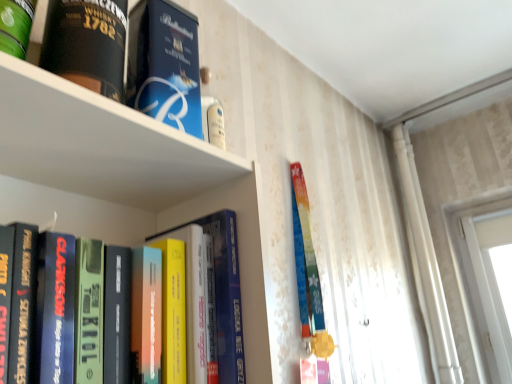
Question: Is blue cardboard box at upper center, positioned as the second book in bottom-to-top order, not inside hardcover book at left, arranged as the fourth book when viewed from the top?

Choices:
 (A) no
 (B) yes

Answer: (B)

Question: Is blue cardboard box at upper center, positioned as the second book in bottom-to-top order, positioned far away from hardcover book at left, arranged as the fourth book when viewed from the top?

Choices:
 (A) yes
 (B) no

Answer: (B)

Question: Considering the relative positions of blue cardboard box at upper center, positioned as the second book in bottom-to-top order, and hardcover book at left, arranged as the fourth book when viewed from the top, in the image provided, is blue cardboard box at upper center, positioned as the second book in bottom-to-top order, to the left of hardcover book at left, arranged as the fourth book when viewed from the top, from the viewer's perspective?

Choices:
 (A) no
 (B) yes

Answer: (A)

Question: Is blue cardboard box at upper center, positioned as the second book in bottom-to-top order, facing away from hardcover book at left, arranged as the fourth book when viewed from the top?

Choices:
 (A) yes
 (B) no

Answer: (B)

Question: Considering the relative sizes of blue cardboard box at upper center, positioned as the second book in bottom-to-top order, and hardcover book at left, marked as the first book in a bottom-to-top arrangement, in the image provided, is blue cardboard box at upper center, positioned as the second book in bottom-to-top order, taller than hardcover book at left, marked as the first book in a bottom-to-top arrangement,?

Choices:
 (A) yes
 (B) no

Answer: (A)

Question: In terms of height, does blue cardboard box at upper center, positioned as the second book in bottom-to-top order, look taller or shorter compared to black matte whiskey bottle at upper left, which is the 3th book from bottom to top?

Choices:
 (A) short
 (B) tall

Answer: (A)

Question: Considering their positions, is blue cardboard box at upper center, positioned as the second book in bottom-to-top order, located in front of or behind black matte whiskey bottle at upper left, which is the 3th book from bottom to top?

Choices:
 (A) behind
 (B) front

Answer: (A)

Question: Visually, is blue cardboard box at upper center, placed as the third book when sorted from top to bottom, positioned to the left or to the right of black matte whiskey bottle at upper left, which is counted as the second book, starting from the top?

Choices:
 (A) left
 (B) right

Answer: (B)

Question: From the image's perspective, is blue cardboard box at upper center, placed as the third book when sorted from top to bottom, above or below black matte whiskey bottle at upper left, which is counted as the second book, starting from the top?

Choices:
 (A) below
 (B) above

Answer: (A)

Question: In the image, is hardcover book at left, marked as the first book in a bottom-to-top arrangement, on the left side or the right side of green matte canister at upper left, which is counted as the 4th book, starting from the bottom?

Choices:
 (A) right
 (B) left

Answer: (A)

Question: Is hardcover book at left, marked as the first book in a bottom-to-top arrangement, wider or thinner than green matte canister at upper left, which is counted as the 4th book, starting from the bottom?

Choices:
 (A) thin
 (B) wide

Answer: (B)

Question: From the image's perspective, is hardcover book at left, arranged as the fourth book when viewed from the top, positioned above or below green matte canister at upper left, which appears as the 1th book when viewed from the top?

Choices:
 (A) below
 (B) above

Answer: (A)

Question: From a real-world perspective, is hardcover book at left, arranged as the fourth book when viewed from the top, positioned above or below green matte canister at upper left, which is counted as the 4th book, starting from the bottom?

Choices:
 (A) below
 (B) above

Answer: (A)

Question: Is green matte canister at upper left, which is counted as the 4th book, starting from the bottom, wider or thinner than hardcover book at left, marked as the first book in a bottom-to-top arrangement?

Choices:
 (A) wide
 (B) thin

Answer: (B)

Question: From a real-world perspective, is green matte canister at upper left, which appears as the 1th book when viewed from the top, physically located above or below hardcover book at left, marked as the first book in a bottom-to-top arrangement?

Choices:
 (A) below
 (B) above

Answer: (B)